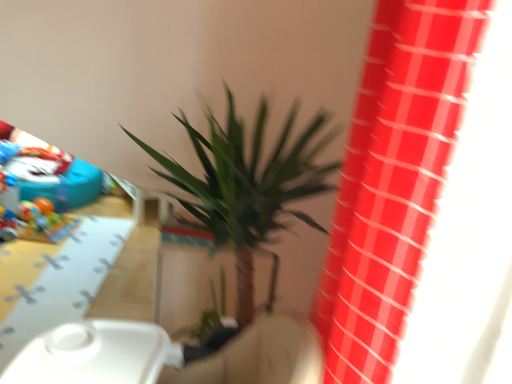
Question: From the image's perspective, would you say yellow matte table at lower left is positioned over green leafy plant at center?

Choices:
 (A) no
 (B) yes

Answer: (A)

Question: Is yellow matte table at lower left outside green leafy plant at center?

Choices:
 (A) yes
 (B) no

Answer: (A)

Question: Considering the relative sizes of yellow matte table at lower left and green leafy plant at center in the image provided, is yellow matte table at lower left taller than green leafy plant at center?

Choices:
 (A) yes
 (B) no

Answer: (B)

Question: Can you confirm if yellow matte table at lower left is smaller than green leafy plant at center?

Choices:
 (A) yes
 (B) no

Answer: (A)

Question: From a real-world perspective, is yellow matte table at lower left over green leafy plant at center?

Choices:
 (A) no
 (B) yes

Answer: (A)

Question: Is glossy plastic curtain at upper right in front of or behind green leafy plant at center in the image?

Choices:
 (A) behind
 (B) front

Answer: (B)

Question: In terms of width, does glossy plastic curtain at upper right look wider or thinner when compared to green leafy plant at center?

Choices:
 (A) thin
 (B) wide

Answer: (A)

Question: Does point (413, 119) appear closer or farther from the camera than point (275, 170)?

Choices:
 (A) closer
 (B) farther

Answer: (A)

Question: From the image's perspective, relative to green leafy plant at center, is glossy plastic curtain at upper right above or below?

Choices:
 (A) below
 (B) above

Answer: (B)

Question: From their relative heights in the image, would you say yellow matte table at lower left is taller or shorter than glossy plastic curtain at upper right?

Choices:
 (A) short
 (B) tall

Answer: (A)

Question: From the image's perspective, is yellow matte table at lower left above or below glossy plastic curtain at upper right?

Choices:
 (A) below
 (B) above

Answer: (A)

Question: In terms of size, does yellow matte table at lower left appear bigger or smaller than glossy plastic curtain at upper right?

Choices:
 (A) small
 (B) big

Answer: (A)

Question: Is point (109, 223) closer or farther from the camera than point (365, 66)?

Choices:
 (A) closer
 (B) farther

Answer: (B)

Question: Visually, is green leafy plant at center positioned to the left or to the right of glossy plastic curtain at upper right?

Choices:
 (A) right
 (B) left

Answer: (B)

Question: Considering the positions of point (253, 152) and point (454, 19), is point (253, 152) closer or farther from the camera than point (454, 19)?

Choices:
 (A) closer
 (B) farther

Answer: (B)